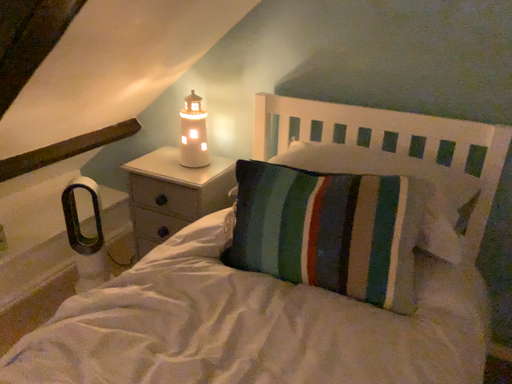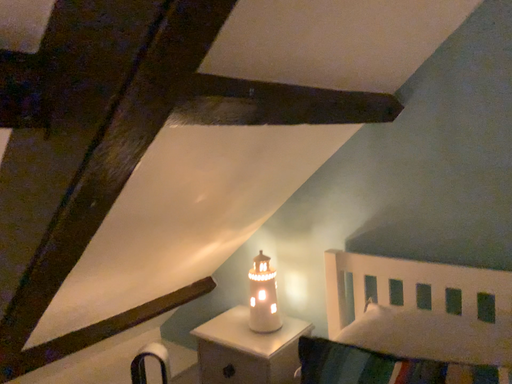
Question: How did the camera likely rotate when shooting the video?

Choices:
 (A) rotated downward
 (B) rotated upward

Answer: (B)